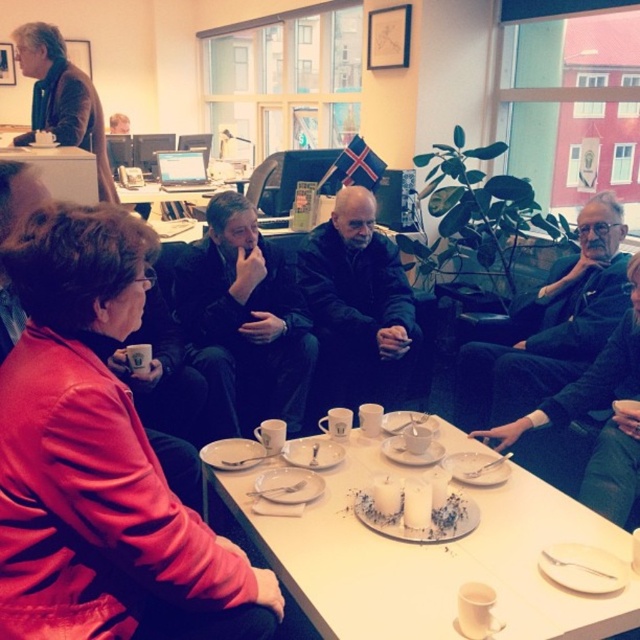
Is white ceramic table at center behind black leather jacket at center?

No, it is not.

Which is in front, point (568, 612) or point (324, 406)?

Positioned in front is point (568, 612).

Is point (266, 544) in front of point (412, 333)?

Yes, it is in front of point (412, 333).

The height and width of the screenshot is (640, 640). Identify the location of white ceramic table at center. (433, 557).

In the scene shown: Who is taller, matte red jacket at lower left or white ceramic saucer at center?

Standing taller between the two is matte red jacket at lower left.

Is matte red jacket at lower left further to camera compared to white ceramic saucer at center?

No.

Which is in front, point (163, 508) or point (385, 449)?

Point (163, 508) is more forward.

Locate an element on the screen. This screenshot has height=640, width=640. matte red jacket at lower left is located at coordinates (99, 460).

Which is above, white ceramic table at center or white ceramic saucer at center?

Positioned higher is white ceramic saucer at center.

Based on the photo, between white ceramic table at center and white ceramic saucer at center, which one has less height?

With less height is white ceramic saucer at center.

Does point (403, 554) lie behind point (428, 445)?

No.

I want to click on white ceramic table at center, so click(433, 557).